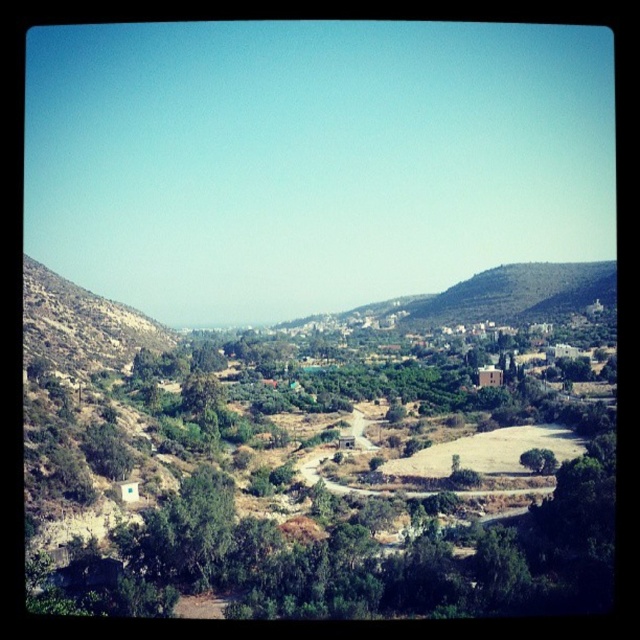
Question: Does green leafy tree at center come in front of green shrubbery at left?

Choices:
 (A) yes
 (B) no

Answer: (A)

Question: Which is farther from the green grassy hillside at upper right?

Choices:
 (A) green shrubbery at left
 (B) green leafy tree at center

Answer: (A)

Question: Where is green shrubbery at left located in relation to green grassy hillside at upper right in the image?

Choices:
 (A) left
 (B) right

Answer: (A)

Question: Does green leafy tree at center appear on the right side of green shrubbery at left?

Choices:
 (A) yes
 (B) no

Answer: (A)

Question: Which object appears farthest from the camera in this image?

Choices:
 (A) green leafy tree at center
 (B) green shrubbery at left
 (C) green grassy hillside at upper right

Answer: (C)

Question: Among these points, which one is nearest to the camera?

Choices:
 (A) (269, 516)
 (B) (500, 320)

Answer: (A)